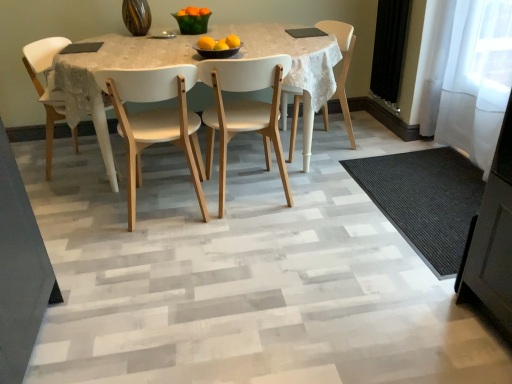
Question: Considering the relative sizes of matte black bowl at center and white wood chair at center, which appears as the second chair when viewed from the right, in the image provided, is matte black bowl at center taller than white wood chair at center, which appears as the second chair when viewed from the right,?

Choices:
 (A) yes
 (B) no

Answer: (B)

Question: Does matte black bowl at center lie behind white wood chair at center, which appears as the second chair when viewed from the right?

Choices:
 (A) no
 (B) yes

Answer: (B)

Question: Is white wood chair at center, which appears as the second chair when viewed from the right, inside matte black bowl at center?

Choices:
 (A) no
 (B) yes

Answer: (A)

Question: Does matte black bowl at center appear on the right side of white wood chair at center, the third chair when ordered from left to right?

Choices:
 (A) yes
 (B) no

Answer: (B)

Question: Can you confirm if matte black bowl at center is bigger than white wood chair at center, the third chair when ordered from left to right?

Choices:
 (A) yes
 (B) no

Answer: (B)

Question: Can you confirm if matte black bowl at center is smaller than white wood chair at center, the third chair when ordered from left to right?

Choices:
 (A) no
 (B) yes

Answer: (B)

Question: Considering the relative positions of white wood chair at center, which appears as the second chair when viewed from the right, and yellow matte/orange at center, placed as the 2th orange when sorted from left to right, in the image provided, is white wood chair at center, which appears as the second chair when viewed from the right, to the right of yellow matte/orange at center, placed as the 2th orange when sorted from left to right, from the viewer's perspective?

Choices:
 (A) no
 (B) yes

Answer: (B)

Question: Does white wood chair at center, the third chair when ordered from left to right, lie in front of yellow matte/orange at center, placed as the 2th orange when sorted from left to right?

Choices:
 (A) no
 (B) yes

Answer: (B)

Question: Is white wood chair at center, which appears as the second chair when viewed from the right, positioned with its back to yellow matte/orange at center, placed as the 2th orange when sorted from left to right?

Choices:
 (A) no
 (B) yes

Answer: (A)

Question: Is white wood chair at center, which appears as the second chair when viewed from the right, not inside yellow matte/orange at center, which is the second orange from right to left?

Choices:
 (A) yes
 (B) no

Answer: (A)

Question: From a real-world perspective, is white wood chair at center, which appears as the second chair when viewed from the right, over yellow matte/orange at center, which is the second orange from right to left?

Choices:
 (A) no
 (B) yes

Answer: (A)

Question: Can you confirm if white wood chair at center, the third chair when ordered from left to right, is wider than yellow matte/orange at center, placed as the 2th orange when sorted from left to right?

Choices:
 (A) no
 (B) yes

Answer: (B)

Question: Is white wood chair at center, arranged as the fourth chair when viewed from the left, positioned with its back to black textured mat at lower right?

Choices:
 (A) no
 (B) yes

Answer: (A)